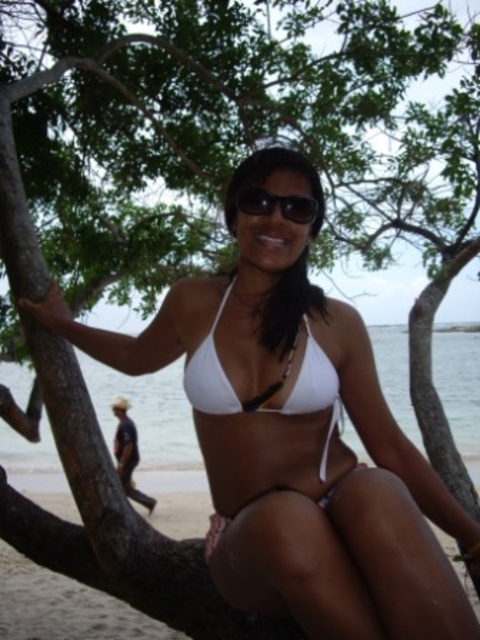
Question: Is white matte bikini at center above white matte bikini top at center?

Choices:
 (A) yes
 (B) no

Answer: (B)

Question: From the image, what is the correct spatial relationship of white matte bikini at center in relation to black plastic sunglasses at center?

Choices:
 (A) left
 (B) right

Answer: (A)

Question: Can you confirm if white matte bikini at center is positioned to the left of black plastic sunglasses at center?

Choices:
 (A) yes
 (B) no

Answer: (A)

Question: Among these points, which one is farthest from the camera?

Choices:
 (A) tap(266, 193)
 (B) tap(323, 371)

Answer: (A)

Question: Which of the following is the farthest from the observer?

Choices:
 (A) (109, 582)
 (B) (332, 392)

Answer: (A)

Question: Which point is closer to the camera taking this photo?

Choices:
 (A) tap(294, 220)
 (B) tap(224, 420)
 (C) tap(168, 561)
 (D) tap(190, 381)

Answer: (D)